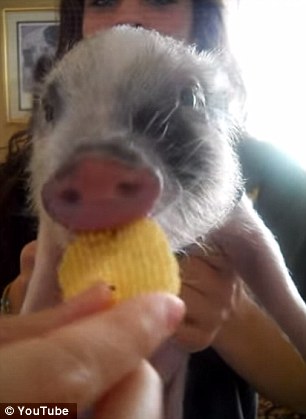
The width and height of the screenshot is (306, 419). I want to click on wall, so click(x=34, y=1).